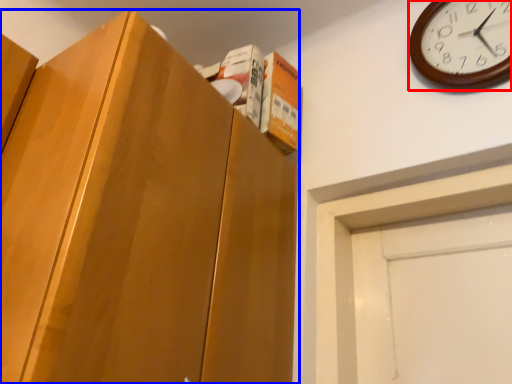
Question: Which point is further to the camera, wall clock (highlighted by a red box) or cabinetry (highlighted by a blue box)?

Choices:
 (A) wall clock
 (B) cabinetry

Answer: (A)